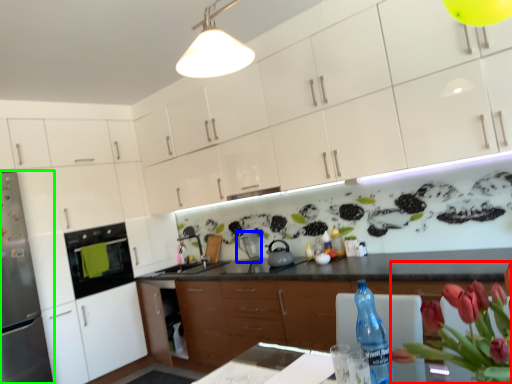
Question: Based on their relative distances, which object is nearer to floral arrangement (highlighted by a red box)? Choose from appliance (highlighted by a blue box) and refrigerator (highlighted by a green box).

Choices:
 (A) appliance
 (B) refrigerator

Answer: (A)